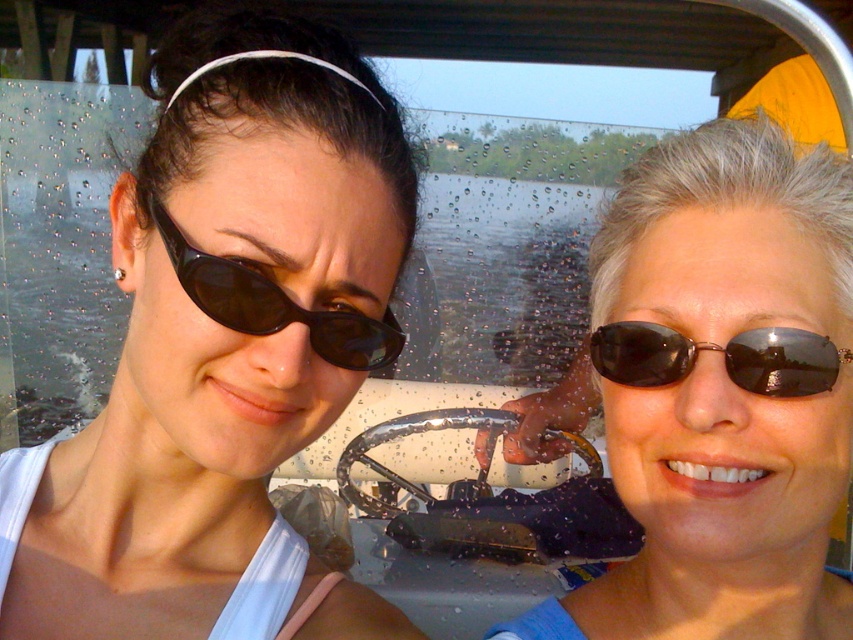
Which of these two, shiny black sunglasses at center or black reflective sunglasses at right, stands shorter?

black reflective sunglasses at right

Is shiny black sunglasses at center behind black reflective sunglasses at right?

No.

Between point (683, 218) and point (677, 369), which one is positioned in front?

Positioned in front is point (677, 369).

In order to click on shiny black sunglasses at center in this screenshot , I will do `click(721, 392)`.

From the picture: Is black reflective sunglasses at right to the right of black matte sunglasses at left from the viewer's perspective?

Yes, black reflective sunglasses at right is to the right of black matte sunglasses at left.

Is black reflective sunglasses at right smaller than black matte sunglasses at left?

Indeed, black reflective sunglasses at right has a smaller size compared to black matte sunglasses at left.

Image resolution: width=853 pixels, height=640 pixels. Identify the location of black reflective sunglasses at right. pos(723,356).

Can you confirm if shiny black sunglasses at center is shorter than black matte sunglasses at left?

No.

Can you confirm if shiny black sunglasses at center is wider than black matte sunglasses at left?

Correct, the width of shiny black sunglasses at center exceeds that of black matte sunglasses at left.

Which is behind, point (813, 529) or point (369, 349)?

Positioned behind is point (813, 529).

What are the coordinates of `shiny black sunglasses at center` in the screenshot? It's located at (721, 392).